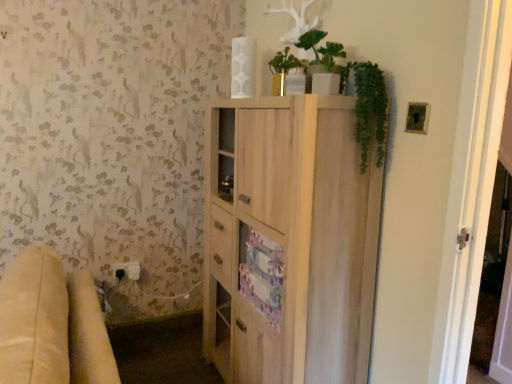
Consider the image. What is the approximate height of white plastic electric outlet at lower left?

white plastic electric outlet at lower left is 3.66 inches tall.

Find the location of a particular element. This screenshot has width=512, height=384. white plastic electric outlet at lower left is located at coordinates (127, 270).

Can you tell me how much light wood cabinet at center and white plastic electric outlet at lower left differ in facing direction?

They differ by 90.2 degrees in their facing directions.

In the scene shown: From a real-world perspective, is light wood cabinet at center over white plastic electric outlet at lower left?

Yes, from a real-world perspective, light wood cabinet at center is above white plastic electric outlet at lower left.

Does light wood cabinet at center have a lesser height compared to white plastic electric outlet at lower left?

No.

From the image's perspective, does light wood cabinet at center appear lower than white plastic electric outlet at lower left?

No.

Which is more to the right, green matte plant at upper center or light wood cabinet at center?

green matte plant at upper center.

Would you consider green matte plant at upper center to be distant from light wood cabinet at center?

No, green matte plant at upper center is in close proximity to light wood cabinet at center.

Is green matte plant at upper center spatially inside light wood cabinet at center, or outside of it?

green matte plant at upper center is not inside light wood cabinet at center, it's outside.

Could you tell me if green matte plant at upper center is turned towards light wood cabinet at center?

No, green matte plant at upper center is not aimed at light wood cabinet at center.

From a real-world perspective, which is physically above, light wood cabinet at center or beige fabric couch at lower left?

In real-world perspective, light wood cabinet at center is above.

Is light wood cabinet at center oriented towards beige fabric couch at lower left?

Yes, light wood cabinet at center is facing beige fabric couch at lower left.

Is light wood cabinet at center shorter than beige fabric couch at lower left?

No, light wood cabinet at center is not shorter than beige fabric couch at lower left.

Where is `cabinetry on the right side of beige fabric couch at lower left`? The width and height of the screenshot is (512, 384). cabinetry on the right side of beige fabric couch at lower left is located at coordinates (288, 241).

Where is `electric outlet on the left of green leafy plant at upper right`? electric outlet on the left of green leafy plant at upper right is located at coordinates (127, 270).

From a real-world perspective, which object rests below the other?

In real-world perspective, white plastic electric outlet at lower left is lower.

From the image's perspective, is white plastic electric outlet at lower left positioned above or below green leafy plant at upper right?

white plastic electric outlet at lower left is below green leafy plant at upper right.

Consider the image. From the image's perspective, is green matte plant at upper center above white plastic electric outlet at lower left?

Indeed, from the image's perspective, green matte plant at upper center is shown above white plastic electric outlet at lower left.

Could you tell me if green matte plant at upper center is turned towards white plastic electric outlet at lower left?

No, green matte plant at upper center does not turn towards white plastic electric outlet at lower left.

Between green matte plant at upper center and white plastic electric outlet at lower left, which one has smaller size?

With smaller size is white plastic electric outlet at lower left.

Considering the sizes of objects green matte plant at upper center and white plastic electric outlet at lower left in the image provided, who is thinner, green matte plant at upper center or white plastic electric outlet at lower left?

white plastic electric outlet at lower left is thinner.

Which object is wider, light wood cabinet at center or green matte plant at upper center?

light wood cabinet at center.

Considering the sizes of objects light wood cabinet at center and green matte plant at upper center in the image provided, who is bigger, light wood cabinet at center or green matte plant at upper center?

With larger size is light wood cabinet at center.

Locate an element on the screen. cabinetry that is in front of the green matte plant at upper center is located at coordinates (288, 241).

Is light wood cabinet at center touching green matte plant at upper center?

No, light wood cabinet at center is not beside green matte plant at upper center.

From the image's perspective, is white plastic electric outlet at lower left above or below beige fabric couch at lower left?

Based on their image positions, white plastic electric outlet at lower left is located above beige fabric couch at lower left.

From the picture: Are white plastic electric outlet at lower left and beige fabric couch at lower left located far from each other?

That's right, there is a large distance between white plastic electric outlet at lower left and beige fabric couch at lower left.

Can you tell me how much white plastic electric outlet at lower left and beige fabric couch at lower left differ in facing direction?

There is a 87.6-degree angle between the facing directions of white plastic electric outlet at lower left and beige fabric couch at lower left.

Find the location of `studio couch on the right of white plastic electric outlet at lower left`. studio couch on the right of white plastic electric outlet at lower left is located at coordinates (52, 325).

You are a GUI agent. You are given a task and a screenshot of the screen. Output one action in this format:
    pyautogui.click(x=<x>, y=<y>)
    Task: Click on the electric outlet on the left of light wood cabinet at center
    
    Given the screenshot: What is the action you would take?
    pyautogui.click(x=127, y=270)

There is a light wood cabinet at center. Identify the location of houseplant above it (from a real-world perspective). Image resolution: width=512 pixels, height=384 pixels. (321, 49).

Which object lies further to the anchor point green leafy plant at upper right, green matte plant at upper center or light wood cabinet at center?

Based on the image, light wood cabinet at center appears to be further to green leafy plant at upper right.

From the image, which object appears to be nearer to light wood cabinet at center, green matte plant at upper center or green leafy plant at upper right?

Among the two, green leafy plant at upper right is located nearer to light wood cabinet at center.

Estimate the real-world distances between objects in this image. Which object is further from green matte plant at upper center, light wood cabinet at center or white plastic electric outlet at lower left?

The object further to green matte plant at upper center is white plastic electric outlet at lower left.

Considering their positions, is beige fabric couch at lower left positioned closer to white plastic electric outlet at lower left than green leafy plant at upper right?

beige fabric couch at lower left.

Which object lies nearer to the anchor point beige fabric couch at lower left, light wood cabinet at center or white plastic electric outlet at lower left?

The object closer to beige fabric couch at lower left is light wood cabinet at center.

From the image, which object appears to be nearer to beige fabric couch at lower left, green leafy plant at upper right or green matte plant at upper center?

green leafy plant at upper right is positioned closer to the anchor beige fabric couch at lower left.

Which object lies further to the anchor point white plastic electric outlet at lower left, beige fabric couch at lower left or light wood cabinet at center?

Based on the image, beige fabric couch at lower left appears to be further to white plastic electric outlet at lower left.

Estimate the real-world distances between objects in this image. Which object is further from green matte plant at upper center, light wood cabinet at center or green leafy plant at upper right?

Based on the image, light wood cabinet at center appears to be further to green matte plant at upper center.

The image size is (512, 384). I want to click on cabinetry situated between beige fabric couch at lower left and green leafy plant at upper right from left to right, so click(x=288, y=241).

Image resolution: width=512 pixels, height=384 pixels. Identify the location of plant located between beige fabric couch at lower left and white plastic electric outlet at lower left in the depth direction. (369, 110).

Where is `houseplant between beige fabric couch at lower left and white plastic electric outlet at lower left along the z-axis`? The height and width of the screenshot is (384, 512). houseplant between beige fabric couch at lower left and white plastic electric outlet at lower left along the z-axis is located at coordinates (321, 49).

At what (x,y) coordinates should I click in order to perform the action: click on cabinetry between green matte plant at upper center and beige fabric couch at lower left from top to bottom. Please return your answer as a coordinate pair (x, y). This screenshot has width=512, height=384. Looking at the image, I should click on tap(288, 241).